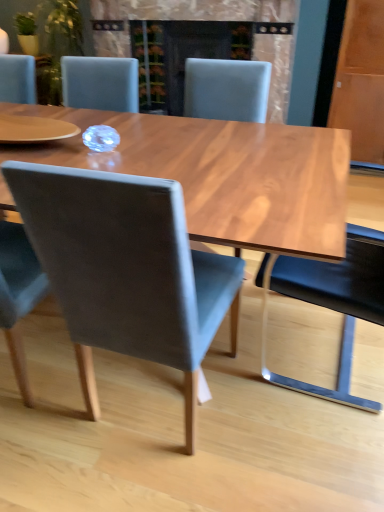
Find the location of a particular element. This screenshot has height=512, width=384. free spot in front of velvet grey chair at center, the second chair viewed from the left is located at coordinates (153, 484).